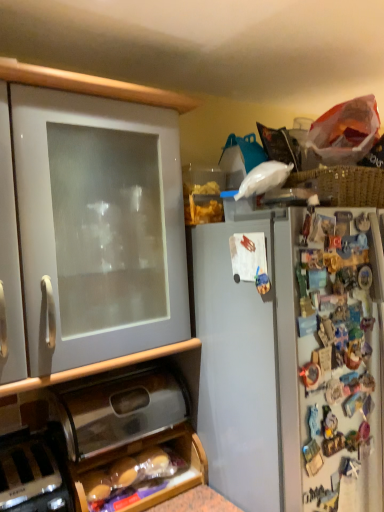
At what (x,y) coordinates should I click in order to perform the action: click on metallic silver breadbox at lower center, the first cabinetry from the bottom. Please return your answer as a coordinate pair (x, y). Image resolution: width=384 pixels, height=512 pixels. Looking at the image, I should click on (120, 368).

You are a GUI agent. You are given a task and a screenshot of the screen. Output one action in this format:
    pyautogui.click(x=<x>, y=<y>)
    Task: Click on the metallic silver breadbox at lower center, the first cabinetry from the bottom
    The width and height of the screenshot is (384, 512).
    Given the screenshot: What is the action you would take?
    pyautogui.click(x=120, y=368)

Based on the photo, can you confirm if white matte cabinet at left, marked as the 2th cabinetry in a bottom-to-top arrangement, is taller than black plastic toaster at lower left?

Indeed, white matte cabinet at left, marked as the 2th cabinetry in a bottom-to-top arrangement, has a greater height compared to black plastic toaster at lower left.

Which is closer, (125, 90) or (68, 496)?

Point (125, 90).

You are a GUI agent. You are given a task and a screenshot of the screen. Output one action in this format:
    pyautogui.click(x=<x>, y=<y>)
    Task: Click on the appliance behind the white matte cabinet at left, marked as the 2th cabinetry in a bottom-to-top arrangement
    
    Given the screenshot: What is the action you would take?
    pyautogui.click(x=32, y=475)

Does white matte cabinet at left, the 1th cabinetry positioned from the top, have a smaller size compared to black plastic toaster at lower left?

No, white matte cabinet at left, the 1th cabinetry positioned from the top, is not smaller than black plastic toaster at lower left.

In the scene shown: From the image's perspective, is black plastic toaster at lower left over white matte cabinet at left, the 1th cabinetry positioned from the top?

Incorrect, from the image's perspective, black plastic toaster at lower left is lower than white matte cabinet at left, the 1th cabinetry positioned from the top.

Is white matte cabinet at left, marked as the 2th cabinetry in a bottom-to-top arrangement, completely or partially inside black plastic toaster at lower left?

No, white matte cabinet at left, marked as the 2th cabinetry in a bottom-to-top arrangement, is not a part of black plastic toaster at lower left.

Is point (5, 501) more distant than point (143, 90)?

That is False.

Is black plastic toaster at lower left at the left side of white matte cabinet at left, marked as the 2th cabinetry in a bottom-to-top arrangement?

Yes, black plastic toaster at lower left is to the left of white matte cabinet at left, marked as the 2th cabinetry in a bottom-to-top arrangement.

Does white matte cabinet at left, the 1th cabinetry positioned from the top, have a greater height compared to metallic silver breadbox at lower center, the second cabinetry viewed from the top?

Yes.

Between white matte cabinet at left, the 1th cabinetry positioned from the top, and metallic silver breadbox at lower center, the second cabinetry viewed from the top, which one has smaller width?

metallic silver breadbox at lower center, the second cabinetry viewed from the top, is thinner.

Is point (29, 81) behind point (67, 373)?

No, it is in front of (67, 373).

In the scene shown: Measure the distance between black plastic toaster at lower left and metallic silver breadbox at lower center, the first cabinetry from the bottom.

black plastic toaster at lower left and metallic silver breadbox at lower center, the first cabinetry from the bottom, are 11.80 inches apart from each other.

From a real-world perspective, is black plastic toaster at lower left physically below metallic silver breadbox at lower center, the first cabinetry from the bottom?

Yes, from a real-world perspective, black plastic toaster at lower left is beneath metallic silver breadbox at lower center, the first cabinetry from the bottom.

Are black plastic toaster at lower left and metallic silver breadbox at lower center, the first cabinetry from the bottom, located far from each other?

No, there isn't a large distance between black plastic toaster at lower left and metallic silver breadbox at lower center, the first cabinetry from the bottom.

Does point (17, 469) come in front of point (202, 482)?

Yes, it is.

Which point is more forward, (1, 386) or (36, 473)?

The point (1, 386) is closer to the camera.

Is metallic silver breadbox at lower center, the first cabinetry from the bottom, far away from black plastic toaster at lower left?

No, there isn't a large distance between metallic silver breadbox at lower center, the first cabinetry from the bottom, and black plastic toaster at lower left.

From a real-world perspective, which object stands above the other?

In real-world perspective, metallic silver breadbox at lower center, the first cabinetry from the bottom, is above.

From the image's perspective, is metallic silver breadbox at lower center, the first cabinetry from the bottom, located above black plastic toaster at lower left?

Yes.

Consider the image. Considering the relative sizes of metallic silver breadbox at lower center, the first cabinetry from the bottom, and white matte cabinet at left, marked as the 2th cabinetry in a bottom-to-top arrangement, in the image provided, is metallic silver breadbox at lower center, the first cabinetry from the bottom, thinner than white matte cabinet at left, marked as the 2th cabinetry in a bottom-to-top arrangement,?

Indeed, metallic silver breadbox at lower center, the first cabinetry from the bottom, has a lesser width compared to white matte cabinet at left, marked as the 2th cabinetry in a bottom-to-top arrangement.

Looking at this image, is metallic silver breadbox at lower center, the second cabinetry viewed from the top, at the right side of white matte cabinet at left, the 1th cabinetry positioned from the top?

Yes, metallic silver breadbox at lower center, the second cabinetry viewed from the top, is to the right of white matte cabinet at left, the 1th cabinetry positioned from the top.

In the scene shown: Does metallic silver breadbox at lower center, the first cabinetry from the bottom, lie behind white matte cabinet at left, marked as the 2th cabinetry in a bottom-to-top arrangement?

Yes, it is behind white matte cabinet at left, marked as the 2th cabinetry in a bottom-to-top arrangement.

How much distance is there between metallic silver breadbox at lower center, the second cabinetry viewed from the top, and white matte cabinet at left, the 1th cabinetry positioned from the top?

They are 2.44 centimeters apart.

The width and height of the screenshot is (384, 512). I want to click on appliance behind the white matte cabinet at left, marked as the 2th cabinetry in a bottom-to-top arrangement, so click(32, 475).

This screenshot has width=384, height=512. Find the location of `the 2nd cabinetry above when counting from the black plastic toaster at lower left (from the image's perspective)`. the 2nd cabinetry above when counting from the black plastic toaster at lower left (from the image's perspective) is located at coordinates (102, 96).

Which object lies nearer to the anchor point black plastic toaster at lower left, metallic silver breadbox at lower center, the second cabinetry viewed from the top, or white matte cabinet at left, the 1th cabinetry positioned from the top?

metallic silver breadbox at lower center, the second cabinetry viewed from the top, lies closer to black plastic toaster at lower left than the other object.

Which object lies further to the anchor point white matte cabinet at left, marked as the 2th cabinetry in a bottom-to-top arrangement, black plastic toaster at lower left or metallic silver breadbox at lower center, the first cabinetry from the bottom?

black plastic toaster at lower left lies further to white matte cabinet at left, marked as the 2th cabinetry in a bottom-to-top arrangement, than the other object.

Looking at the image, which one is located further to black plastic toaster at lower left, white matte cabinet at left, marked as the 2th cabinetry in a bottom-to-top arrangement, or metallic silver breadbox at lower center, the first cabinetry from the bottom?

The object further to black plastic toaster at lower left is white matte cabinet at left, marked as the 2th cabinetry in a bottom-to-top arrangement.

Considering their positions, is black plastic toaster at lower left positioned further to metallic silver breadbox at lower center, the second cabinetry viewed from the top, than white matte cabinet at left, the 1th cabinetry positioned from the top?

Among the two, black plastic toaster at lower left is located further to metallic silver breadbox at lower center, the second cabinetry viewed from the top.

Based on their spatial positions, is white matte cabinet at left, the 1th cabinetry positioned from the top, or black plastic toaster at lower left closer to metallic silver breadbox at lower center, the second cabinetry viewed from the top?

white matte cabinet at left, the 1th cabinetry positioned from the top, lies closer to metallic silver breadbox at lower center, the second cabinetry viewed from the top, than the other object.

Estimate the real-world distances between objects in this image. Which object is closer to white matte cabinet at left, the 1th cabinetry positioned from the top, metallic silver breadbox at lower center, the second cabinetry viewed from the top, or black plastic toaster at lower left?

metallic silver breadbox at lower center, the second cabinetry viewed from the top, is closer to white matte cabinet at left, the 1th cabinetry positioned from the top.

Identify the location of cabinetry between white matte cabinet at left, the 1th cabinetry positioned from the top, and black plastic toaster at lower left vertically. (120, 368).